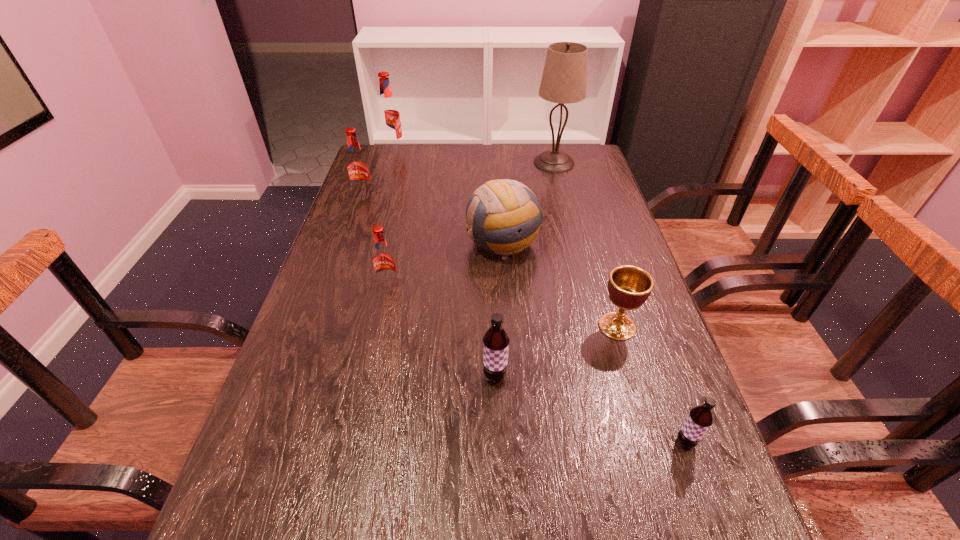
You are a GUI agent. You are given a task and a screenshot of the screen. Output one action in this format:
    pyautogui.click(x=<x>, y=<y>)
    Task: Click on the lampshade
    
    Given the screenshot: What is the action you would take?
    coord(564,80)

Locate an element on the screen. the second tallest object is located at coordinates (388, 113).

I want to click on the biggest red root beer, so click(x=388, y=113).

Identify the location of the second biggest red root beer. Image resolution: width=960 pixels, height=540 pixels. (357, 165).

You are a GUI agent. You are given a task and a screenshot of the screen. Output one action in this format:
    pyautogui.click(x=<x>, y=<y>)
    Task: Click on the sixth shortest object
    
    Given the screenshot: What is the action you would take?
    pyautogui.click(x=357, y=165)

Where is `the fourth farthest object`? The width and height of the screenshot is (960, 540). the fourth farthest object is located at coordinates tap(504, 216).

The image size is (960, 540). Identify the location of the third root beer from right to left. (384, 264).

Locate an element on the screen. The height and width of the screenshot is (540, 960). the third nearest root beer is located at coordinates (x=384, y=264).

At what (x,y) coordinates should I click in order to perform the action: click on the left brown root beer. Please return your answer as a coordinate pair (x, y). The width and height of the screenshot is (960, 540). Looking at the image, I should click on (496, 341).

The width and height of the screenshot is (960, 540). Identify the location of the farther brown root beer. (x=496, y=341).